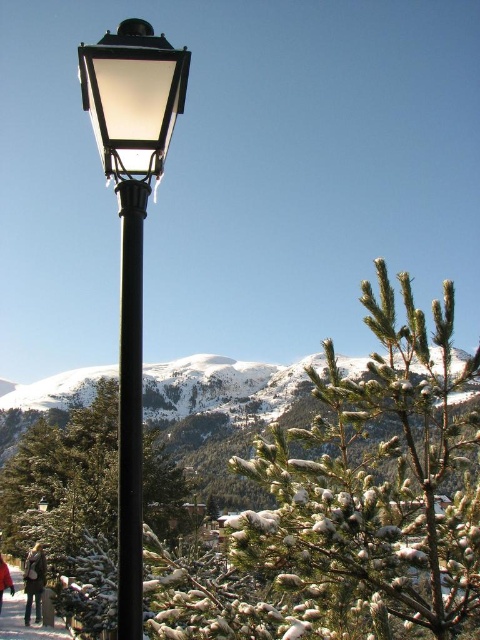
You are standing at the base of the lamppost in the winter scene. You see two points marked in the image. Which point is closer to you, point (127, 33) or point (8, 593)?

Point (127, 33) is closer to you because it is in front of point (8, 593).

Based on the photo, you are an architect designing a new streetlight system. You need to ensure that the new streetlights are not too thin compared to the existing black matte pole at center. Given that the matte glass streetlight at upper left is already installed, which one should you use as a reference for the minimum thickness requirement?

The matte glass streetlight at upper left is thinner than the black matte pole at center, so you should use the black matte pole at center as the reference for the minimum thickness requirement to ensure the new streetlights are not too thin.

You are standing in the winter scene and want to take a photo of the matte glass streetlight at upper left and the matte black pole at lower left. Which object should you point your camera at first to capture both in the frame?

You should point your camera at the matte black pole at lower left first because the matte glass streetlight at upper left is above it, so adjusting the frame from the lower to upper position will include both objects.